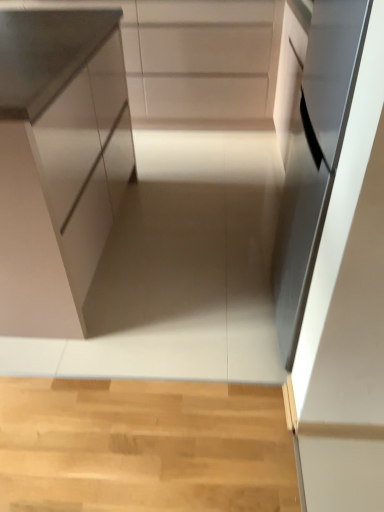
You are a GUI agent. You are given a task and a screenshot of the screen. Output one action in this format:
    pyautogui.click(x=<x>, y=<y>)
    Task: Click on the vacant space situated on the left part of satin black oven at right
    The image size is (384, 512).
    Given the screenshot: What is the action you would take?
    pyautogui.click(x=210, y=322)